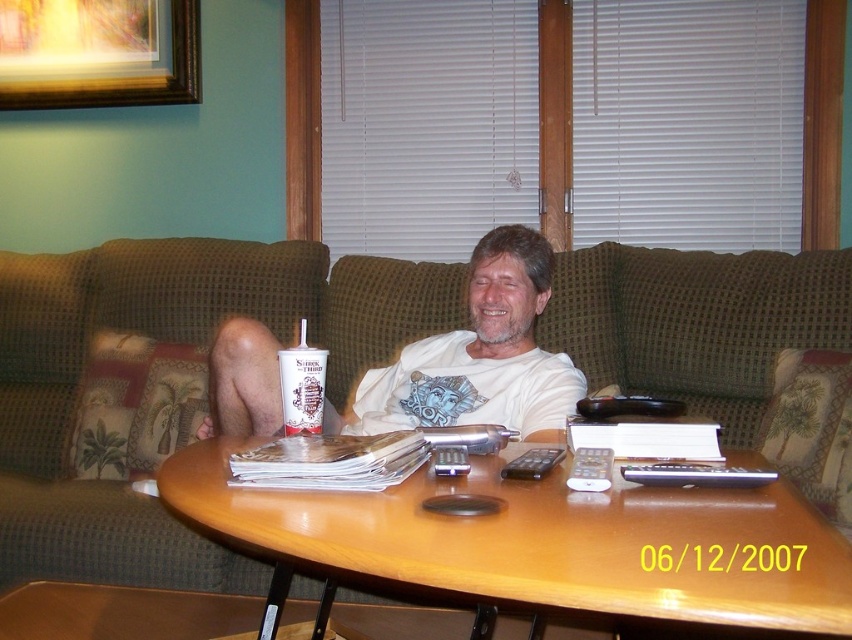
You are a delivery person who needs to place a small package on the brown wood table at center. Can you fit the package on the table without touching the silver metallic remote at center?

The brown wood table at center has a larger size compared to silver metallic remote at center, so yes, the package can be placed on the table without touching the silver metallic remote at center.